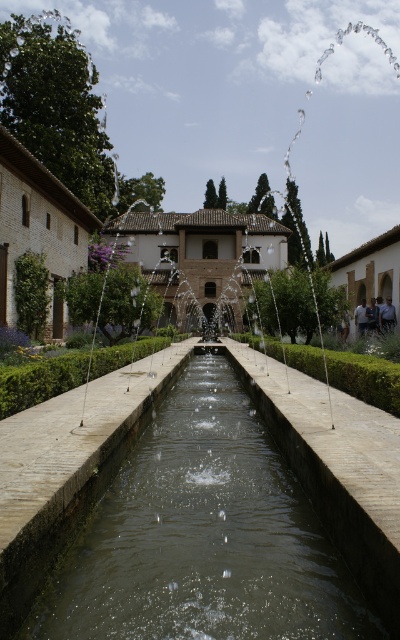
Question: Observing the image, what is the correct spatial positioning of clear water at center in reference to green stone fountain at center?

Choices:
 (A) below
 (B) above

Answer: (A)

Question: Is clear water at center smaller than green stone fountain at center?

Choices:
 (A) yes
 (B) no

Answer: (A)

Question: Which object appears farthest from the camera in this image?

Choices:
 (A) clear water at center
 (B) green stone fountain at center

Answer: (B)

Question: Which of the following is the farthest from the observer?

Choices:
 (A) clear water at center
 (B) green stone fountain at center

Answer: (B)

Question: Considering the relative positions of clear water at center and green stone fountain at center in the image provided, where is clear water at center located with respect to green stone fountain at center?

Choices:
 (A) above
 (B) below

Answer: (B)